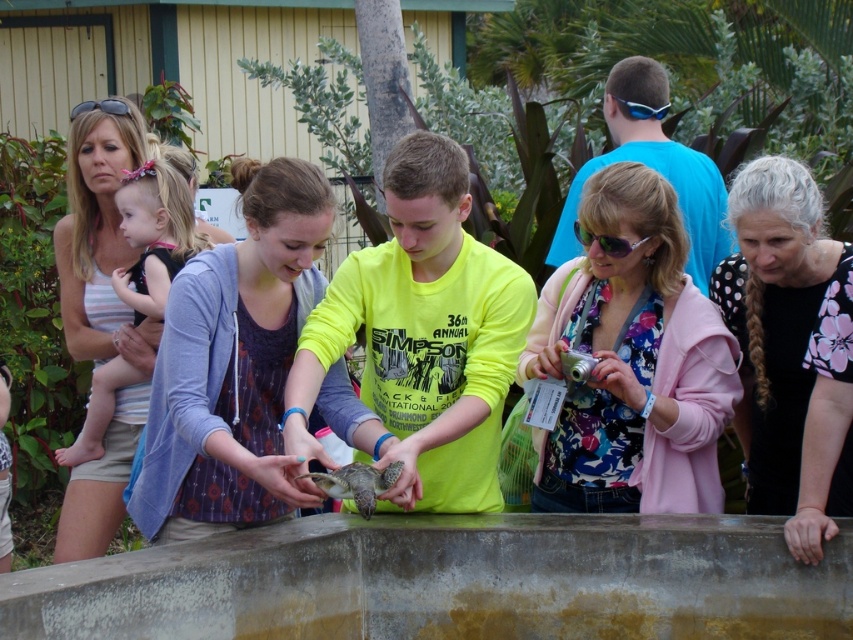
Based on the photo, who is higher up, concrete ledge at center or black plastic sunglasses at upper left?

Positioned higher is black plastic sunglasses at upper left.

Can you confirm if concrete ledge at center is taller than black plastic sunglasses at upper left?

Correct, concrete ledge at center is much taller as black plastic sunglasses at upper left.

Who is more distant from viewer, (x=381, y=544) or (x=83, y=104)?

The point (x=83, y=104) is behind.

At what (x,y) coordinates should I click in order to perform the action: click on concrete ledge at center. Please return your answer as a coordinate pair (x, y). Looking at the image, I should click on (450, 580).

Between concrete ledge at center and floral fabric shirt at center, which one appears on the right side from the viewer's perspective?

Positioned to the right is floral fabric shirt at center.

Which of these two, concrete ledge at center or floral fabric shirt at center, stands shorter?

concrete ledge at center is shorter.

Does point (624, 550) come behind point (732, 412)?

No, it is in front of (732, 412).

Identify the location of concrete ledge at center. The height and width of the screenshot is (640, 853). (450, 580).

Does smooth green turtle at center lie in front of sunglasses at center?

Yes, it is.

Does smooth green turtle at center appear under sunglasses at center?

Indeed, smooth green turtle at center is positioned under sunglasses at center.

Which is in front, point (352, 472) or point (598, 243)?

Point (352, 472)

At what (x,y) coordinates should I click in order to perform the action: click on smooth green turtle at center. Please return your answer as a coordinate pair (x, y). Looking at the image, I should click on (357, 483).